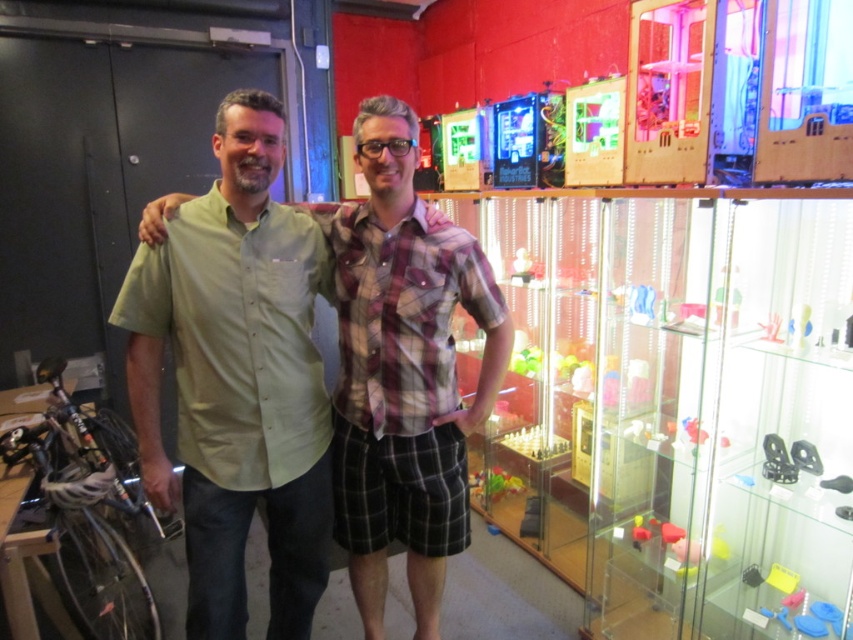
Is clear acrylic display case at right to the right of green cotton shirt at center from the viewer's perspective?

Correct, you'll find clear acrylic display case at right to the right of green cotton shirt at center.

Between clear acrylic display case at right and green cotton shirt at center, which one has less height?

With less height is green cotton shirt at center.

Does point (519, 353) lie in front of point (370, 493)?

No, (519, 353) is further to viewer.

This screenshot has height=640, width=853. In order to click on clear acrylic display case at right in this screenshot , I will do `click(675, 404)`.